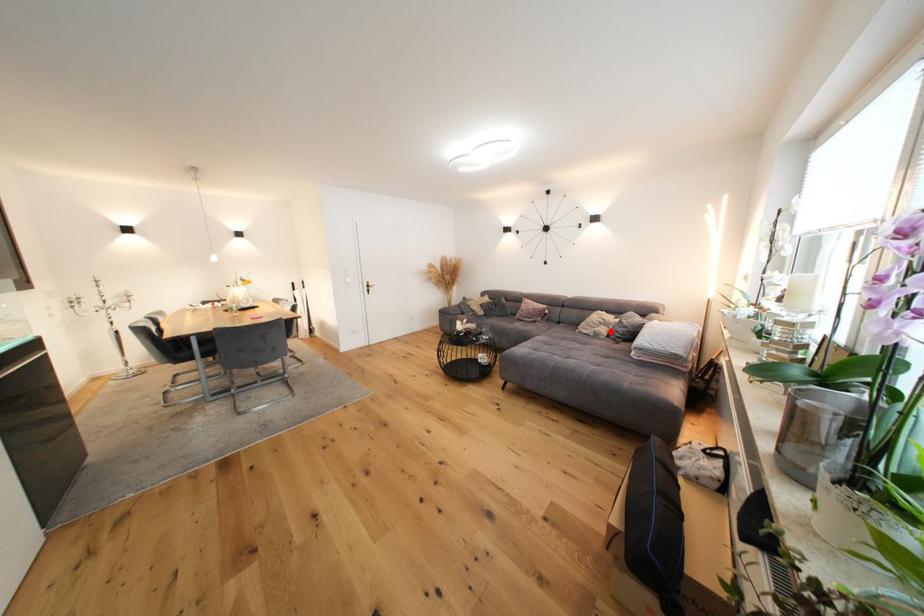
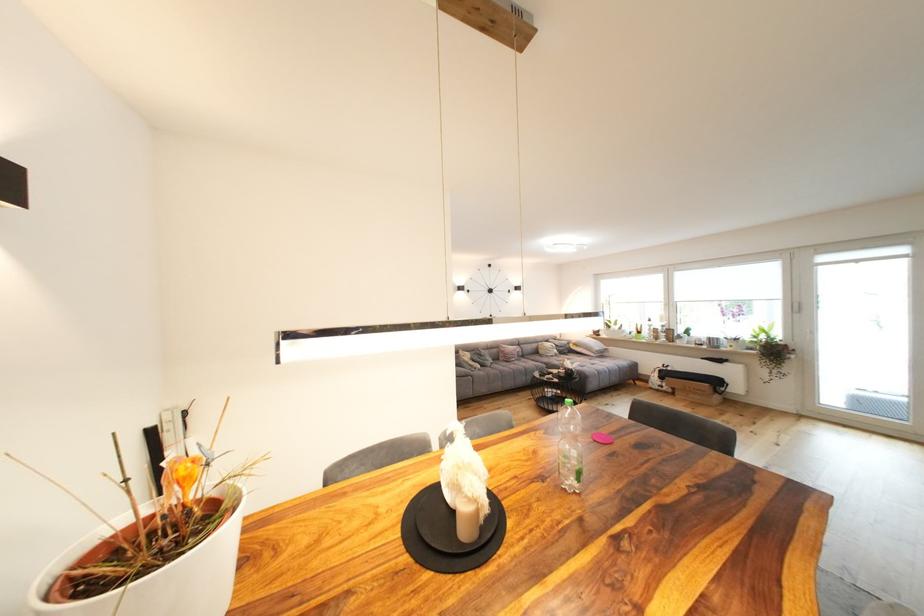
Question: I am providing you with two images of the same scene from different viewpoints. Image1 has a red point marked. In image2, the corresponding 3D location appears at what relative position? Reply with the corresponding letter.

Choices:
 (A) Closer
 (B) Farther

Answer: (B)